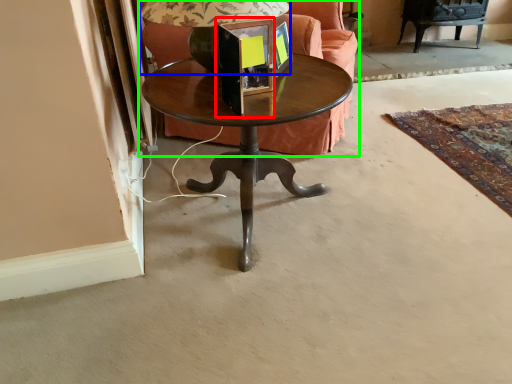
Question: Based on their relative distances, which object is nearer to picture frame (highlighted by a red box)? Choose from table lamp (highlighted by a blue box) and studio couch (highlighted by a green box).

Choices:
 (A) table lamp
 (B) studio couch

Answer: (A)